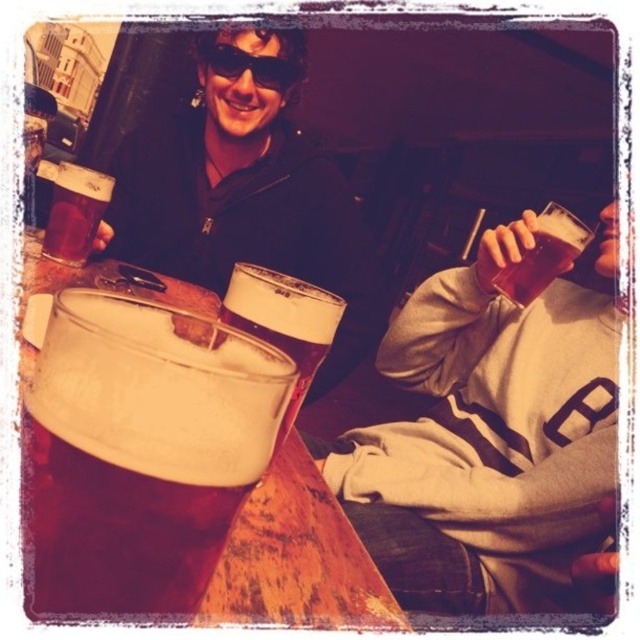
Between point (266, 228) and point (278, 65), which one is positioned in front?

Point (278, 65) is more forward.

Locate an element on the screen. Image resolution: width=640 pixels, height=640 pixels. matte black jacket at upper center is located at coordinates (244, 198).

Can you confirm if brown frothy beer at lower left is positioned below translucent glass mug at center?

Indeed, brown frothy beer at lower left is positioned under translucent glass mug at center.

Does brown frothy beer at lower left have a greater height compared to translucent glass mug at center?

No, brown frothy beer at lower left is not taller than translucent glass mug at center.

Measure the distance between brown frothy beer at lower left and camera.

The distance of brown frothy beer at lower left from camera is 7.92 inches.

I want to click on brown frothy beer at lower left, so click(x=144, y=449).

Can you confirm if translucent glass mug at center is smaller than black plastic goggles at upper center?

Actually, translucent glass mug at center might be larger than black plastic goggles at upper center.

Identify the location of translucent glass mug at center. (284, 323).

Locate an element on the screen. The image size is (640, 640). translucent glass mug at center is located at coordinates (284, 323).